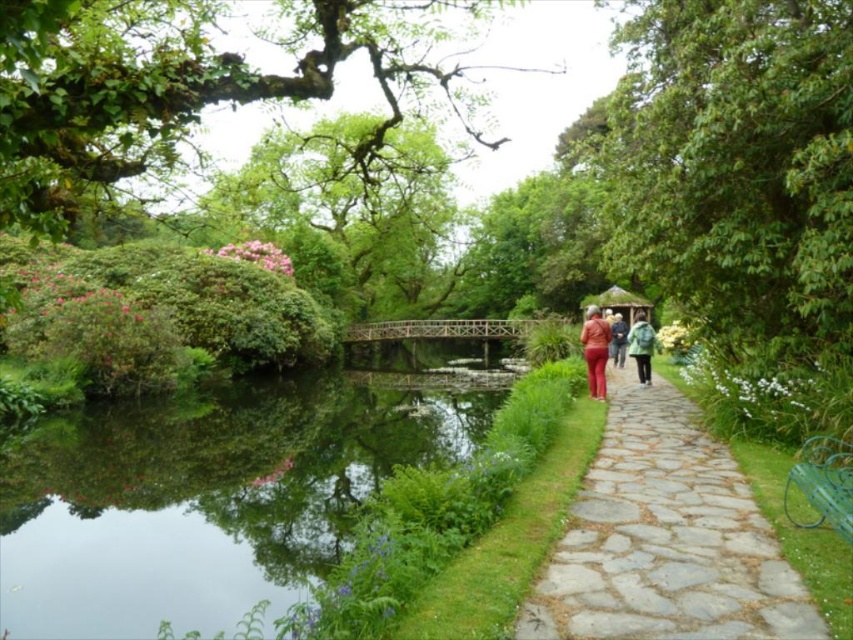
You are standing at the wooden bridge in the garden. You want to walk to the point marked as point (x=209, y=496). Which direction should you go?

The point (x=209, y=496) is on the green reflective water at lower left, so you should go to the lower left direction from the wooden bridge.

You are planning to place a small garden statue that requires a flat surface. The statue is 1 meter tall. Given the scene, which object between the green reflective water at lower left and the green leafy tree at right would be more suitable for placing the statue?

The green leafy tree at right is larger than the green reflective water at lower left, so the statue can be placed near the green leafy tree at right as it offers a more stable and spacious area for placement.

You are planning to place a new bench in the garden. The bench is as wide as the matte red jacket at center. Will the green reflective water at lower left be wide enough to accommodate the bench if placed there?

The green reflective water at lower left is wider than the matte red jacket at center, so yes, the bench can be placed there as the water area is wide enough.